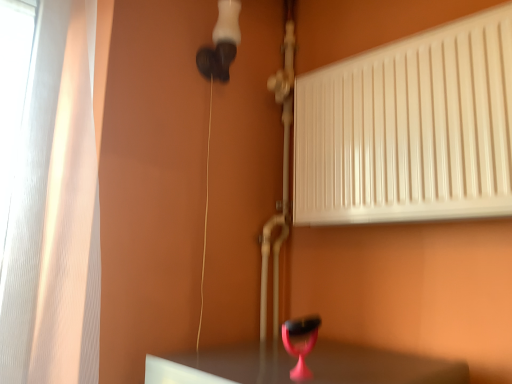
Locate an element on the screen. pink plastic table lamp at lower center is located at coordinates (300, 343).

What do you see at coordinates (300, 343) in the screenshot? The image size is (512, 384). I see `pink plastic table lamp at lower center` at bounding box center [300, 343].

In order to face pink plastic table lamp at lower center, should I rotate leftwards or rightwards?

To align with it, rotate right about 5.879°.

What do you see at coordinates (409, 129) in the screenshot? The height and width of the screenshot is (384, 512). I see `white glossy radiator at upper right` at bounding box center [409, 129].

In order to face white glossy radiator at upper right, should I rotate leftwards or rightwards?

Rotate your view right by about 17.654°.

Where is `white glossy radiator at upper right`? The height and width of the screenshot is (384, 512). white glossy radiator at upper right is located at coordinates (409, 129).

This screenshot has width=512, height=384. In order to click on pink plastic table lamp at lower center in this screenshot , I will do `click(300, 343)`.

Can you confirm if pink plastic table lamp at lower center is positioned to the right of white glossy radiator at upper right?

In fact, pink plastic table lamp at lower center is to the left of white glossy radiator at upper right.

Relative to white glossy radiator at upper right, is pink plastic table lamp at lower center in front or behind?

Visually, pink plastic table lamp at lower center is located in front of white glossy radiator at upper right.

Does point (318, 327) come farther from viewer compared to point (465, 103)?

Yes, point (318, 327) is behind point (465, 103).

From the image's perspective, between pink plastic table lamp at lower center and white glossy radiator at upper right, which one is located above?

white glossy radiator at upper right is shown above in the image.

From a real-world perspective, who is located lower, pink plastic table lamp at lower center or white glossy radiator at upper right?

From a 3D spatial view, pink plastic table lamp at lower center is below.

Considering the sizes of pink plastic table lamp at lower center and white glossy radiator at upper right in the image, is pink plastic table lamp at lower center wider or thinner than white glossy radiator at upper right?

Considering their sizes, pink plastic table lamp at lower center looks slimmer than white glossy radiator at upper right.

Does pink plastic table lamp at lower center have a lesser height compared to white glossy radiator at upper right?

Yes.

Considering the sizes of pink plastic table lamp at lower center and white glossy radiator at upper right in the image, is pink plastic table lamp at lower center bigger or smaller than white glossy radiator at upper right?

Considering their sizes, pink plastic table lamp at lower center takes up less space than white glossy radiator at upper right.

Is pink plastic table lamp at lower center located outside white glossy radiator at upper right?

That's correct, pink plastic table lamp at lower center is outside of white glossy radiator at upper right.

Is pink plastic table lamp at lower center beside white glossy radiator at upper right?

No.

Is pink plastic table lamp at lower center positioned with its back to white glossy radiator at upper right?

No, white glossy radiator at upper right is not at the back of pink plastic table lamp at lower center.

How different are the orientations of pink plastic table lamp at lower center and white glossy radiator at upper right in degrees?

There is a 86.6-degree angle between the facing directions of pink plastic table lamp at lower center and white glossy radiator at upper right.

Locate an element on the screen. table lamp located in front of the white glossy radiator at upper right is located at coordinates (300, 343).

Which is more to the left, white glossy radiator at upper right or pink plastic table lamp at lower center?

pink plastic table lamp at lower center is more to the left.

Is white glossy radiator at upper right further to the viewer compared to pink plastic table lamp at lower center?

Yes, it is.

Considering the positions of point (341, 184) and point (317, 315), is point (341, 184) closer or farther from the camera than point (317, 315)?

Clearly, point (341, 184) is closer to the camera than point (317, 315).

In the scene shown: From the image's perspective, would you say white glossy radiator at upper right is positioned over pink plastic table lamp at lower center?

Yes.

From a real-world perspective, which is physically below, white glossy radiator at upper right or pink plastic table lamp at lower center?

From a 3D spatial view, pink plastic table lamp at lower center is below.

Which of these two, white glossy radiator at upper right or pink plastic table lamp at lower center, is thinner?

Thinner between the two is pink plastic table lamp at lower center.

Which of these two, white glossy radiator at upper right or pink plastic table lamp at lower center, stands taller?

white glossy radiator at upper right is taller.

Looking at this image, is white glossy radiator at upper right bigger than pink plastic table lamp at lower center?

Yes, white glossy radiator at upper right is bigger than pink plastic table lamp at lower center.

Is white glossy radiator at upper right inside the boundaries of pink plastic table lamp at lower center, or outside?

white glossy radiator at upper right is not inside pink plastic table lamp at lower center, it's outside.

Is white glossy radiator at upper right not near pink plastic table lamp at lower center?

That's not correct — white glossy radiator at upper right is a little close to pink plastic table lamp at lower center.

Is white glossy radiator at upper right looking in the opposite direction of pink plastic table lamp at lower center?

No, white glossy radiator at upper right is not facing away from pink plastic table lamp at lower center.

How different are the orientations of white glossy radiator at upper right and pink plastic table lamp at lower center in degrees?

They differ by 86.6 degrees in their facing directions.

You are a GUI agent. You are given a task and a screenshot of the screen. Output one action in this format:
    pyautogui.click(x=<x>, y=<y>)
    Task: Click on the radiator above the pink plastic table lamp at lower center (from a real-world perspective)
    
    Given the screenshot: What is the action you would take?
    pyautogui.click(x=409, y=129)

The height and width of the screenshot is (384, 512). I want to click on table lamp directly beneath the white glossy radiator at upper right (from a real-world perspective), so click(300, 343).

Identify the location of radiator located above the pink plastic table lamp at lower center (from a real-world perspective). This screenshot has height=384, width=512. (409, 129).